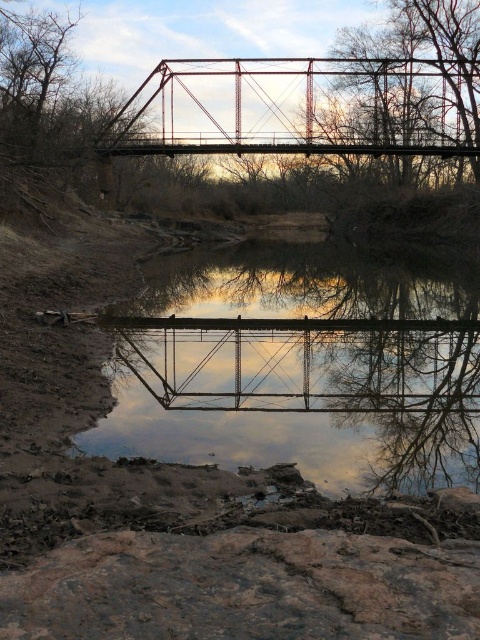
Is point (189, 372) positioned after point (178, 61)?

No, (189, 372) is closer to viewer.

Between reflective glass water at center and metallic red bridge at center, which one appears on the right side from the viewer's perspective?

Positioned to the right is metallic red bridge at center.

Is point (172, 276) closer to viewer compared to point (375, 74)?

Yes, it is.

What are the coordinates of `reflective glass water at center` in the screenshot? It's located at (301, 404).